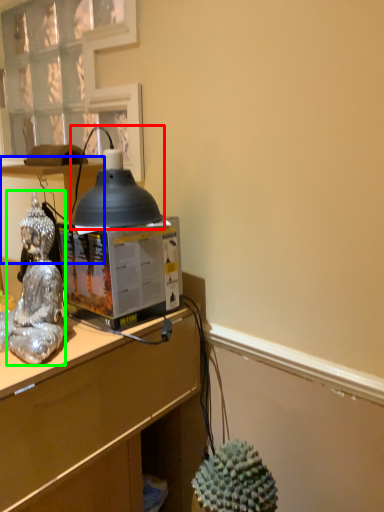
Question: Which is nearer to the lamp (highlighted by a red box)? vanity (highlighted by a blue box) or person (highlighted by a green box).

Choices:
 (A) vanity
 (B) person

Answer: (B)